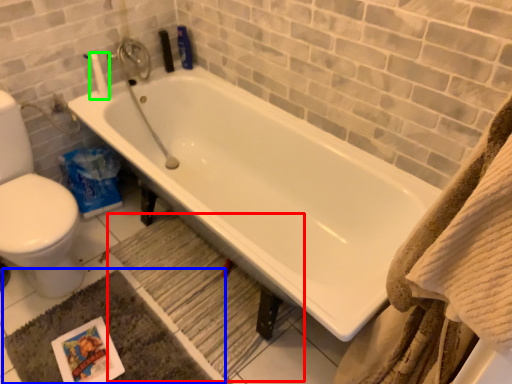
Question: Which object is positioned farthest from bath mat (highlighted by a red box)? Select from bath mat (highlighted by a blue box) and toilet paper (highlighted by a green box).

Choices:
 (A) bath mat
 (B) toilet paper

Answer: (B)